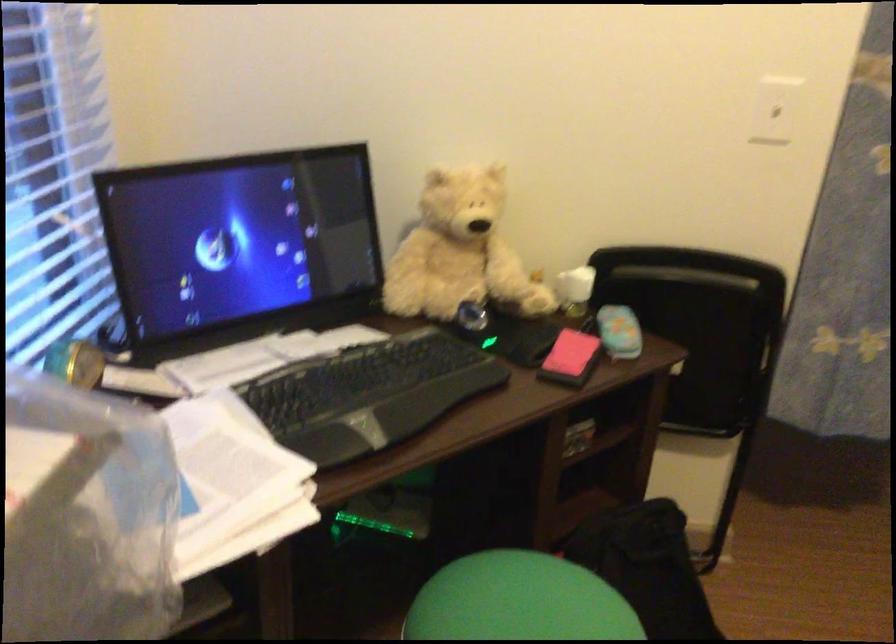
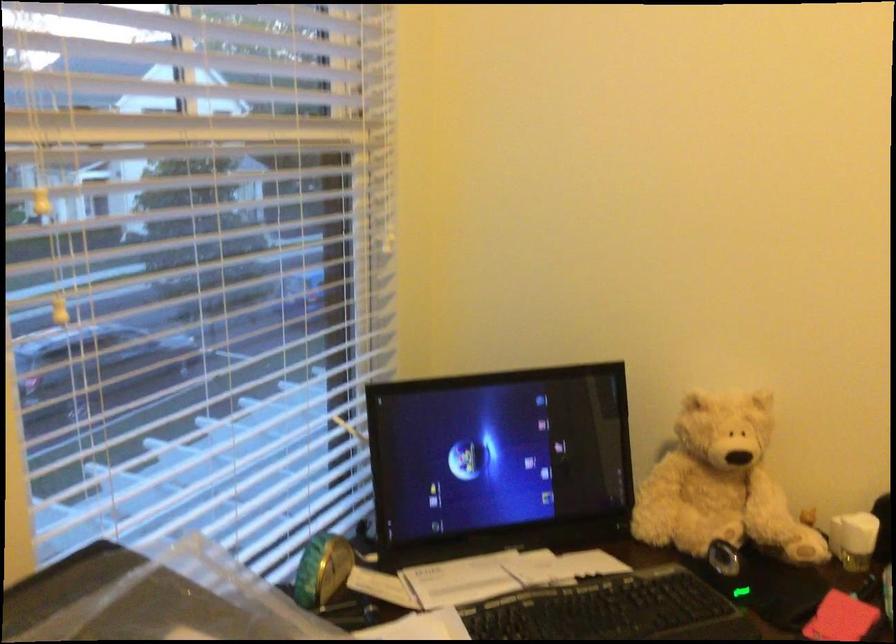
Where in the second image is the point corresponding to (x=467, y=254) from the first image?

(720, 484)